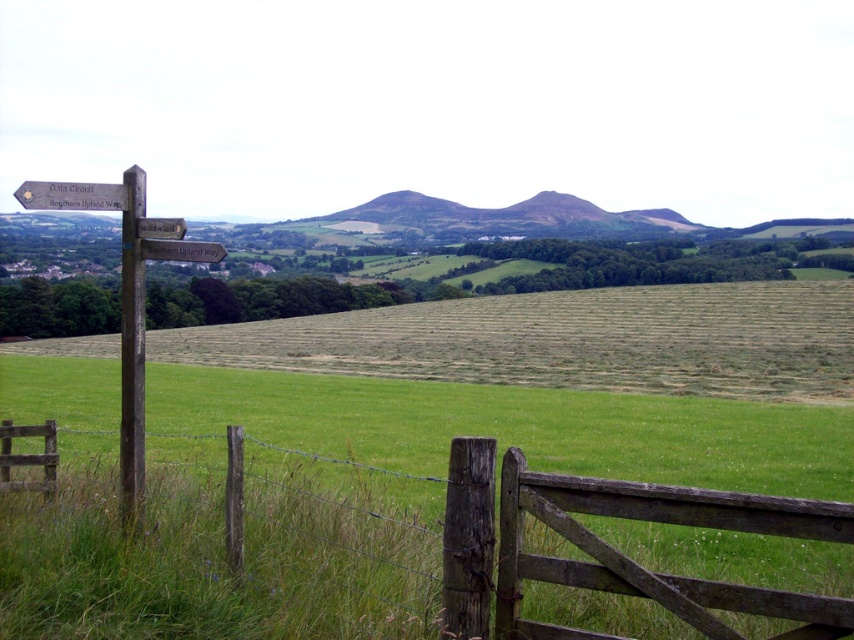
You are standing at the center of the image and want to locate the wooden gate at lower center. Based on the coordinates provided, in which direction should you move to find it?

The wooden gate at lower center is located at coordinates point (393, 557). Since you are at the center, moving towards the lower right direction will lead you to the wooden gate at lower center.

You are standing at the center of the wooden gate with a wire fence in front of you. You need to locate the wooden signpost at left. In which direction should you look relative to your position?

The wooden signpost at left is located to the left side of the wooden gate with a wire fence, so you should look to your left to find it.